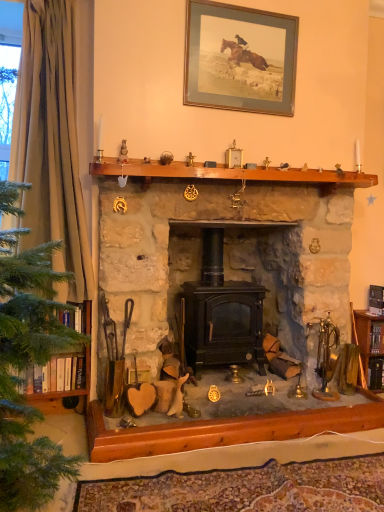
The height and width of the screenshot is (512, 384). What are the coordinates of `vacant space situated above gold-framed print at upper center (from a real-world perspective)` in the screenshot? It's located at (244, 6).